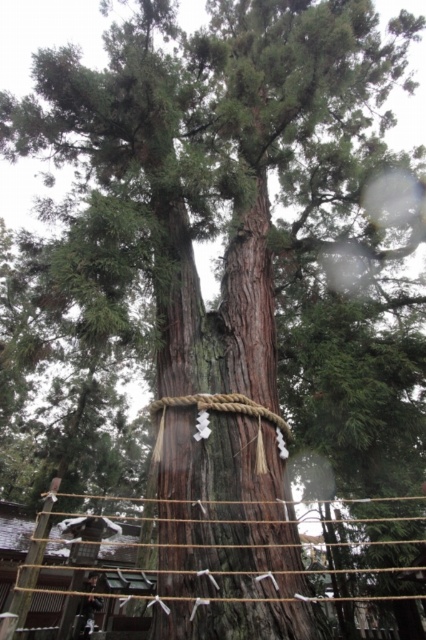
Question: Is brown rough tree trunk at center closer to the viewer compared to braided wood rope bridge at center?

Choices:
 (A) yes
 (B) no

Answer: (B)

Question: Which point is farther from the camera taking this photo?

Choices:
 (A) (400, 544)
 (B) (158, 628)

Answer: (A)

Question: Does brown rough tree trunk at center appear under braided wood rope bridge at center?

Choices:
 (A) no
 (B) yes

Answer: (A)

Question: Among these points, which one is nearest to the camera?

Choices:
 (A) (411, 540)
 (B) (213, 637)

Answer: (B)

Question: Is brown rough tree trunk at center behind braided wood rope bridge at center?

Choices:
 (A) no
 (B) yes

Answer: (B)

Question: Among these objects, which one is farthest from the camera?

Choices:
 (A) brown rough tree trunk at center
 (B) braided wood rope bridge at center

Answer: (A)